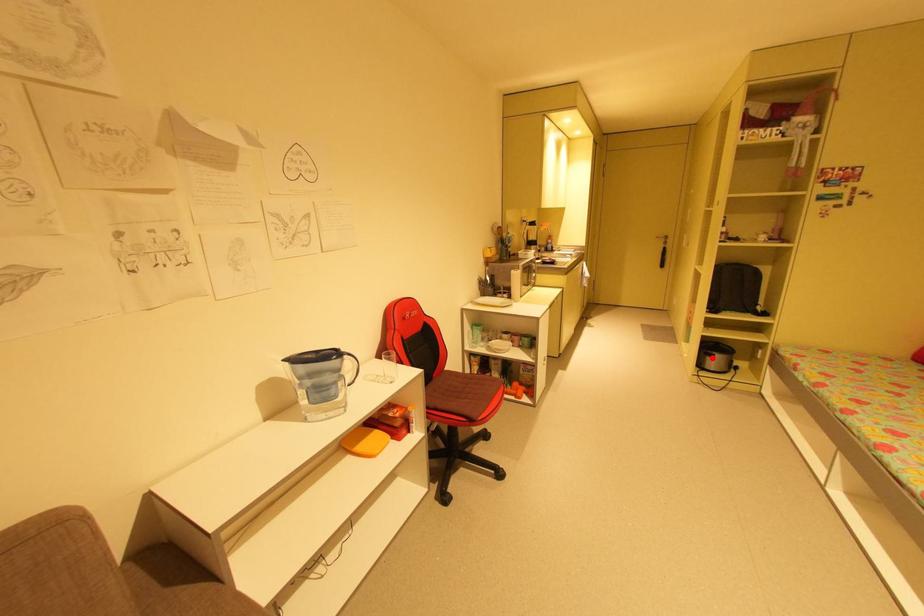
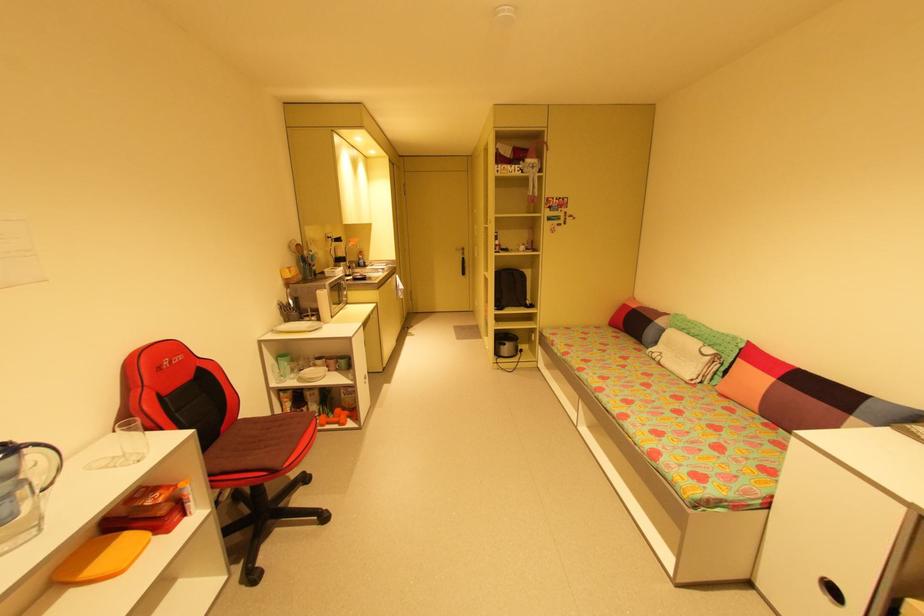
The point at the highlighted location is marked in the first image. Where is the corresponding point in the second image?

(505, 347)